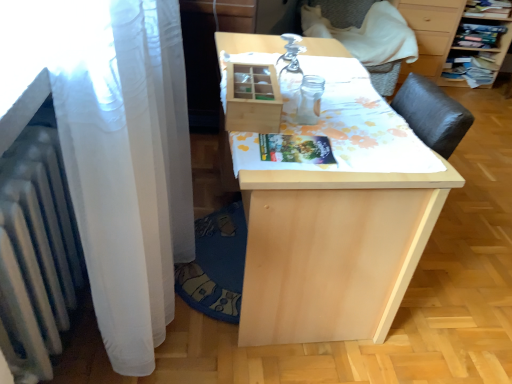
Question: Can you confirm if natural wood table at center is bigger than gray fabric armchair at upper right?

Choices:
 (A) no
 (B) yes

Answer: (B)

Question: From a real-world perspective, does natural wood table at center sit lower than gray fabric armchair at upper right?

Choices:
 (A) no
 (B) yes

Answer: (B)

Question: Is natural wood table at center looking in the opposite direction of gray fabric armchair at upper right?

Choices:
 (A) yes
 (B) no

Answer: (B)

Question: Can we say natural wood table at center lies outside gray fabric armchair at upper right?

Choices:
 (A) no
 (B) yes

Answer: (B)

Question: Can gray fabric armchair at upper right be found inside natural wood table at center?

Choices:
 (A) no
 (B) yes

Answer: (A)

Question: Can you confirm if natural wood table at center is taller than gray fabric armchair at upper right?

Choices:
 (A) yes
 (B) no

Answer: (B)

Question: Considering the relative sizes of natural wood table at center and white metallic radiator at left in the image provided, is natural wood table at center taller than white metallic radiator at left?

Choices:
 (A) yes
 (B) no

Answer: (A)

Question: Is natural wood table at center at the left side of white metallic radiator at left?

Choices:
 (A) yes
 (B) no

Answer: (B)

Question: From the image's perspective, does natural wood table at center appear higher than white metallic radiator at left?

Choices:
 (A) no
 (B) yes

Answer: (B)

Question: Can you confirm if natural wood table at center is thinner than white metallic radiator at left?

Choices:
 (A) yes
 (B) no

Answer: (B)

Question: From a real-world perspective, is natural wood table at center under white metallic radiator at left?

Choices:
 (A) yes
 (B) no

Answer: (A)

Question: Does natural wood table at center touch white metallic radiator at left?

Choices:
 (A) yes
 (B) no

Answer: (B)

Question: Considering the relative positions of natural wood table at center and wooden drawer at upper right in the image provided, is natural wood table at center to the right of wooden drawer at upper right from the viewer's perspective?

Choices:
 (A) yes
 (B) no

Answer: (B)